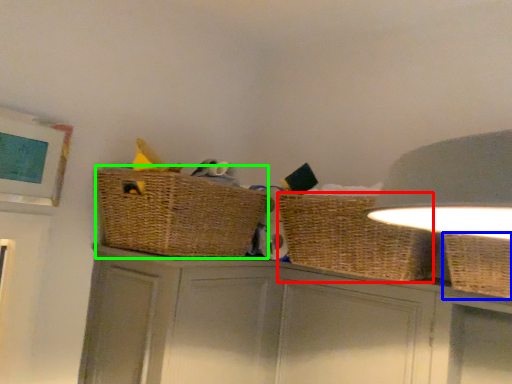
Question: Which is farther away from basket (highlighted by a red box)? basket (highlighted by a blue box) or basket container (highlighted by a green box)?

Choices:
 (A) basket
 (B) basket container

Answer: (B)